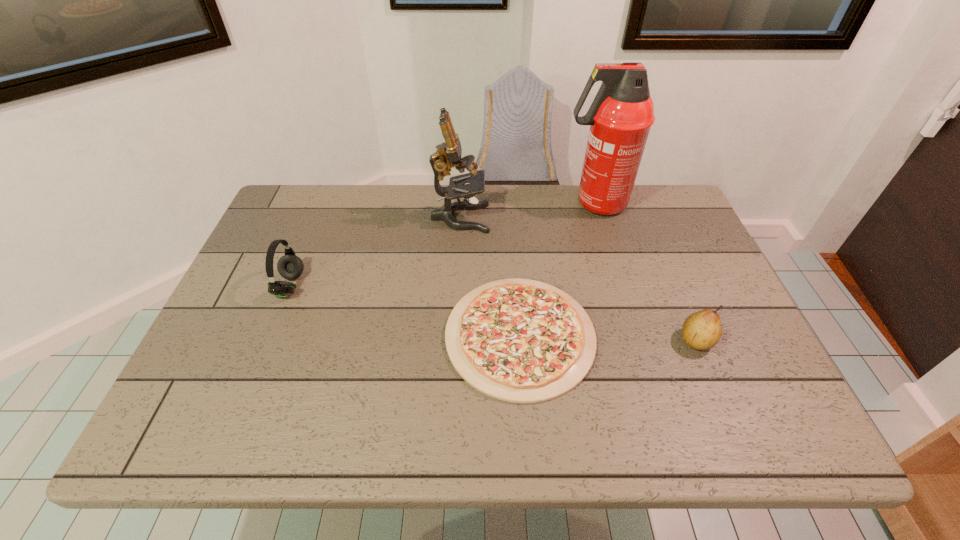
Where is `vacant space that's between the headset and the fire extinguisher`? The width and height of the screenshot is (960, 540). vacant space that's between the headset and the fire extinguisher is located at coordinates (443, 245).

The width and height of the screenshot is (960, 540). Identify the location of vacant area between the second tallest object and the tallest object. (527, 211).

Locate an element on the screen. This screenshot has width=960, height=540. vacant space that's between the second shortest object and the shortest object is located at coordinates (608, 338).

The width and height of the screenshot is (960, 540). I want to click on free space between the second tallest object and the tallest object, so click(x=527, y=211).

Identify which object is the fourth closest to the headset. Please provide its 2D coordinates. Your answer should be formatted as a tuple, i.e. [(x, y)], where the tuple contains the x and y coordinates of a point satisfying the conditions above.

[(702, 330)]

Locate an element on the screen. This screenshot has width=960, height=540. object that is the second closest to the pear is located at coordinates (620, 117).

Where is `vacant space that satisfies the following two spatial constraints: 1. on the ear cups of the third shortest object; 2. on the back side of the pear`? The width and height of the screenshot is (960, 540). vacant space that satisfies the following two spatial constraints: 1. on the ear cups of the third shortest object; 2. on the back side of the pear is located at coordinates (268, 340).

What are the coordinates of `vacant space that satisfies the following two spatial constraints: 1. on the ear cups of the pear; 2. on the right side of the headset` in the screenshot? It's located at (268, 340).

The height and width of the screenshot is (540, 960). Find the location of `free space that satisfies the following two spatial constraints: 1. on the ear cups of the leftmost object; 2. on the back side of the shortest object`. free space that satisfies the following two spatial constraints: 1. on the ear cups of the leftmost object; 2. on the back side of the shortest object is located at coordinates (270, 336).

Locate an element on the screen. This screenshot has width=960, height=540. vacant area that satisfies the following two spatial constraints: 1. at the eyepieces of the pear; 2. on the right side of the second tallest object is located at coordinates (454, 340).